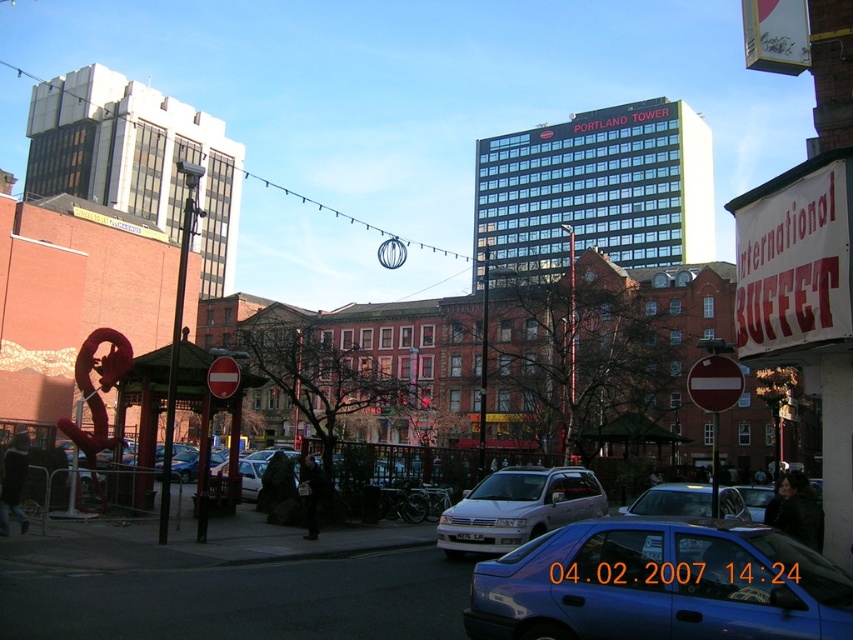
Does point (517, 531) lie in front of point (389, 257)?

Yes.

Who is shorter, white matte suv at center or metallic wire clock at center?

white matte suv at center

Which is in front, point (544, 525) or point (392, 246)?

Point (544, 525) is in front.

Find the location of `white matte suv at center`. white matte suv at center is located at coordinates (518, 508).

Between blue metallic car at center and white matte suv at center, which one is positioned higher?

blue metallic car at center is above.

Is the position of blue metallic car at center less distant than that of white matte suv at center?

Yes.

Between point (788, 620) and point (447, 513), which one is positioned in front?

Point (788, 620)

Find the location of a particular element. The image size is (853, 640). blue metallic car at center is located at coordinates (659, 584).

Between blue metallic car at center and metallic blue sedan at center, which one is positioned higher?

blue metallic car at center

Measure the distance between blue metallic car at center and camera.

blue metallic car at center is 11.58 meters away from camera.

Is point (727, 529) positioned before point (746, 508)?

That is True.

What are the coordinates of `blue metallic car at center` in the screenshot? It's located at (659, 584).